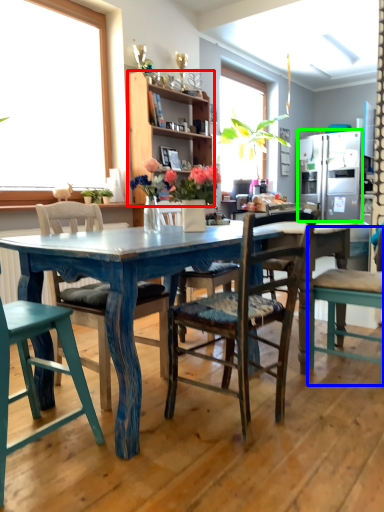
Question: Estimate the real-world distances between objects in this image. Which object is closer to cabinetry (highlighted by a red box), chair (highlighted by a blue box) or refrigerator (highlighted by a green box)?

Choices:
 (A) chair
 (B) refrigerator

Answer: (B)